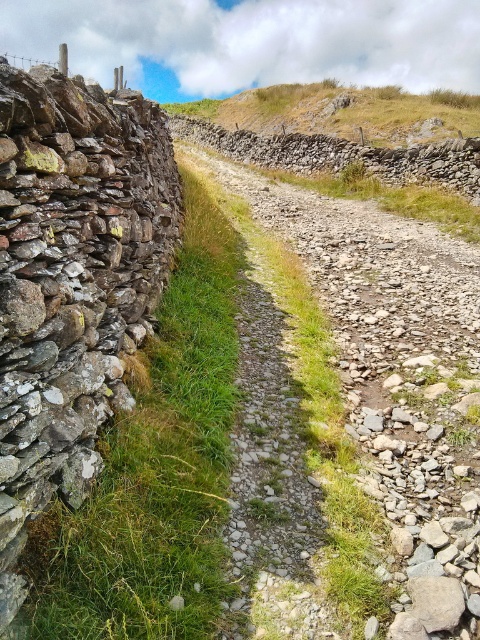
Where is `green grass at left`? The width and height of the screenshot is (480, 640). green grass at left is located at coordinates (156, 468).

Does point (195, 464) come behind point (230, 97)?

No, it is not.

Which is behind, point (191, 596) or point (284, 115)?

The point (284, 115) is more distant.

Where is `green grass at left`? Image resolution: width=480 pixels, height=640 pixels. green grass at left is located at coordinates pos(156,468).

Is gravel path at center positioned behind green grass at left?

Yes, it is.

Image resolution: width=480 pixels, height=640 pixels. What do you see at coordinates (396, 378) in the screenshot?
I see `gravel path at center` at bounding box center [396, 378].

Describe the element at coordinates (396, 378) in the screenshot. I see `gravel path at center` at that location.

Where is `gravel path at center`? gravel path at center is located at coordinates (396, 378).

Is gravel path at center positioned in front of grassy hillside at upper center?

Yes, gravel path at center is closer to the viewer.

Find the location of a particular element. The height and width of the screenshot is (640, 480). gravel path at center is located at coordinates (396, 378).

You are a GUI agent. You are given a task and a screenshot of the screen. Output one action in this format:
    pyautogui.click(x=<x>, y=<y>)
    Task: Click on the gravel path at center
    The width and height of the screenshot is (480, 640).
    Given the screenshot: What is the action you would take?
    pyautogui.click(x=396, y=378)